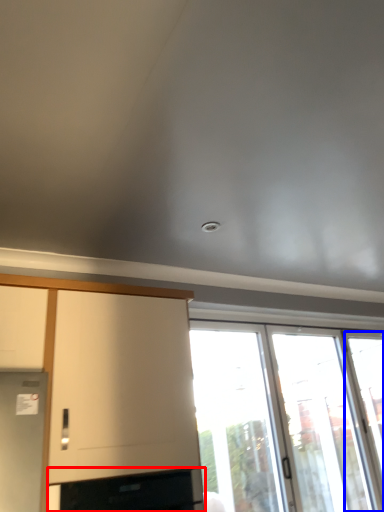
Question: Which point is further to the camera, appliance (highlighted by a red box) or window (highlighted by a blue box)?

Choices:
 (A) appliance
 (B) window

Answer: (B)